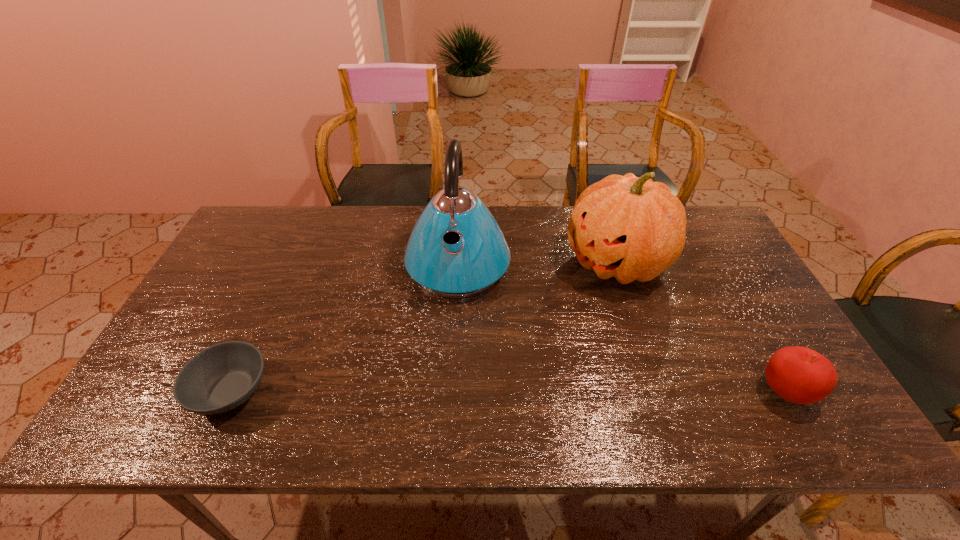
You are a GUI agent. You are given a task and a screenshot of the screen. Output one action in this format:
    pyautogui.click(x=<x>, y=<y>)
    Task: Click on the free spot between the shortest object and the rightmost object
    Image resolution: width=960 pixels, height=540 pixels.
    Given the screenshot: What is the action you would take?
    pyautogui.click(x=508, y=392)

Where is `vacant space that's between the second object from left to right and the apple`? Image resolution: width=960 pixels, height=540 pixels. vacant space that's between the second object from left to right and the apple is located at coordinates (621, 328).

At what (x,y) coordinates should I click in order to perform the action: click on free space between the apple and the leftmost object. Please return your answer as a coordinate pair (x, y). Looking at the image, I should click on (508, 392).

Find the location of `free point between the rightmost object and the pumpkin`. free point between the rightmost object and the pumpkin is located at coordinates pos(700,327).

Identify the location of empty space between the apple and the tallest object. Image resolution: width=960 pixels, height=540 pixels. (621, 328).

Locate an element on the screen. This screenshot has width=960, height=540. free space that is in between the leftmost object and the pumpkin is located at coordinates (423, 327).

Identify the location of free spot between the second tallest object and the shortest object. This screenshot has height=540, width=960. (423, 327).

At what (x,y) coordinates should I click in order to perform the action: click on empty space between the soup bowl and the third shortest object. Please return your answer as a coordinate pair (x, y). The width and height of the screenshot is (960, 540). Looking at the image, I should click on (423, 327).

The height and width of the screenshot is (540, 960). I want to click on vacant space that's between the soup bowl and the pumpkin, so click(423, 327).

The image size is (960, 540). Find the location of `vacant space in between the kettle and the third tallest object`. vacant space in between the kettle and the third tallest object is located at coordinates (621, 328).